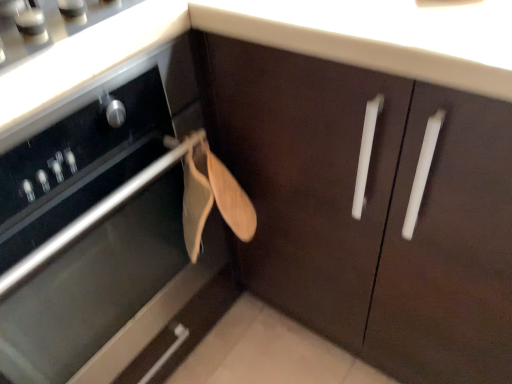
Question: Is satin silver gas stove at upper left inside the boundaries of brown matte cabinet at center, or outside?

Choices:
 (A) inside
 (B) outside

Answer: (B)

Question: Based on their sizes in the image, would you say satin silver gas stove at upper left is bigger or smaller than brown matte cabinet at center?

Choices:
 (A) small
 (B) big

Answer: (A)

Question: Visually, is satin silver gas stove at upper left positioned to the left or to the right of brown matte cabinet at center?

Choices:
 (A) left
 (B) right

Answer: (B)

Question: From a real-world perspective, is brown matte cabinet at center positioned above or below satin silver gas stove at upper left?

Choices:
 (A) below
 (B) above

Answer: (A)

Question: Visually, is brown matte cabinet at center positioned to the left or to the right of satin silver gas stove at upper left?

Choices:
 (A) left
 (B) right

Answer: (A)

Question: From their relative heights in the image, would you say brown matte cabinet at center is taller or shorter than satin silver gas stove at upper left?

Choices:
 (A) tall
 (B) short

Answer: (A)

Question: Considering the positions of brown matte cabinet at center and satin silver gas stove at upper left in the image, is brown matte cabinet at center bigger or smaller than satin silver gas stove at upper left?

Choices:
 (A) small
 (B) big

Answer: (B)